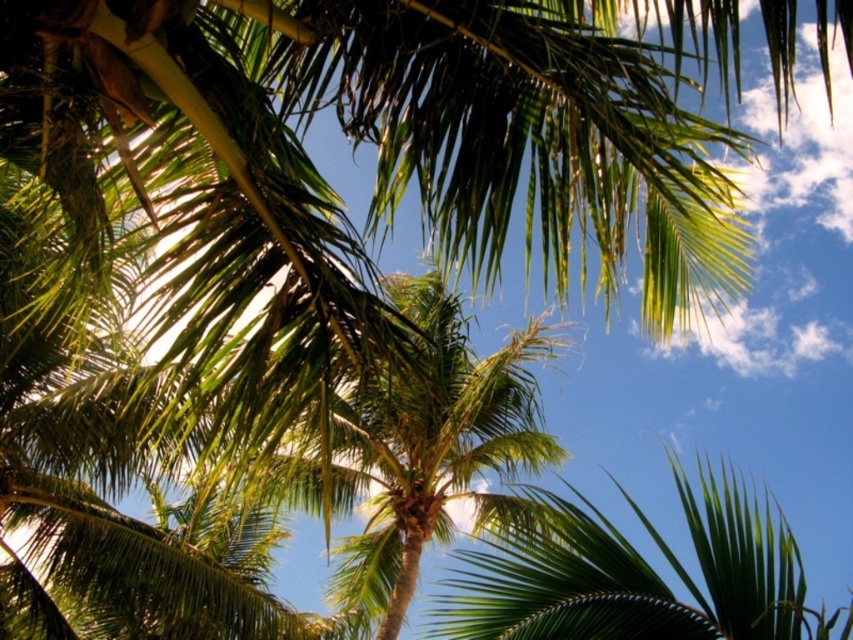
You are standing under the palm trees in the tropical scene. There is a point marked at coordinates (431, 448). Which object from the scene does this point belong to?

The point at coordinates (431, 448) is on the green leafy palm tree at center.

You are a bird seeking shelter in the green leafy palm tree at center and the green leafy palm at center. Which palm has a wider canopy for nesting?

The green leafy palm tree at center has a wider canopy than the green leafy palm at center, so it is better for nesting.